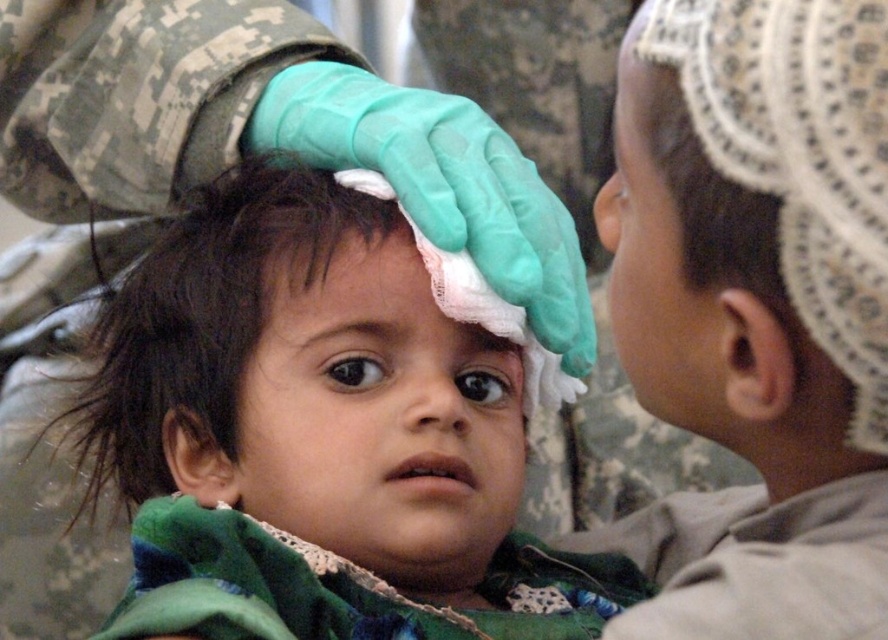
Does white lace headscarf at upper right appear on the left side of dark brown matte hair at center?

Incorrect, white lace headscarf at upper right is not on the left side of dark brown matte hair at center.

Who is more distant from viewer, (x=667, y=227) or (x=271, y=221)?

The point (x=271, y=221) is more distant.

What do you see at coordinates (755, 310) in the screenshot? The image size is (888, 640). I see `white lace headscarf at upper right` at bounding box center [755, 310].

Image resolution: width=888 pixels, height=640 pixels. I want to click on white lace headscarf at upper right, so click(755, 310).

From the picture: Can you confirm if dark brown matte hair at center is shorter than white lace forehead at center?

In fact, dark brown matte hair at center may be taller than white lace forehead at center.

Does dark brown matte hair at center appear on the left side of white lace forehead at center?

Correct, you'll find dark brown matte hair at center to the left of white lace forehead at center.

Is point (156, 460) in front of point (306, 310)?

No, it is behind (306, 310).

Locate an element on the screen. This screenshot has width=888, height=640. dark brown matte hair at center is located at coordinates (203, 317).

Is point (852, 252) positioned after point (373, 237)?

No, it is in front of (373, 237).

Measure the distance from white lace headscarf at upper right to white lace forehead at center.

white lace headscarf at upper right and white lace forehead at center are 18.50 inches apart.

Between point (847, 145) and point (290, 268), which one is positioned in front?

Positioned in front is point (847, 145).

Where is `white lace headscarf at upper right`? white lace headscarf at upper right is located at coordinates (755, 310).